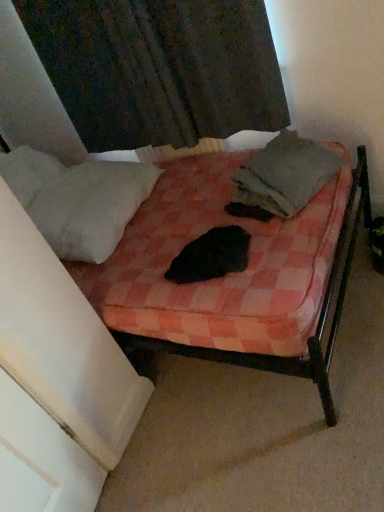
Question: Considering the relative positions of dark fabric curtain at upper center and pink checkered fabric bed at center in the image provided, is dark fabric curtain at upper center to the right of pink checkered fabric bed at center from the viewer's perspective?

Choices:
 (A) no
 (B) yes

Answer: (B)

Question: Does dark fabric curtain at upper center have a greater width compared to pink checkered fabric bed at center?

Choices:
 (A) no
 (B) yes

Answer: (A)

Question: Considering the relative sizes of dark fabric curtain at upper center and pink checkered fabric bed at center in the image provided, is dark fabric curtain at upper center bigger than pink checkered fabric bed at center?

Choices:
 (A) yes
 (B) no

Answer: (B)

Question: Can you confirm if dark fabric curtain at upper center is smaller than pink checkered fabric bed at center?

Choices:
 (A) no
 (B) yes

Answer: (B)

Question: Is dark fabric curtain at upper center completely or partially outside of pink checkered fabric bed at center?

Choices:
 (A) no
 (B) yes

Answer: (A)

Question: From the image's perspective, is gray cotton blanket at center positioned above or below dark fabric curtain at upper center?

Choices:
 (A) below
 (B) above

Answer: (A)

Question: Considering the positions of gray cotton blanket at center and dark fabric curtain at upper center in the image, is gray cotton blanket at center wider or thinner than dark fabric curtain at upper center?

Choices:
 (A) wide
 (B) thin

Answer: (A)

Question: Is gray cotton blanket at center situated inside dark fabric curtain at upper center or outside?

Choices:
 (A) inside
 (B) outside

Answer: (B)

Question: From a real-world perspective, is gray cotton blanket at center above or below dark fabric curtain at upper center?

Choices:
 (A) below
 (B) above

Answer: (A)

Question: Considering the positions of pink checkered fabric bed at center and gray cotton blanket at center in the image, is pink checkered fabric bed at center taller or shorter than gray cotton blanket at center?

Choices:
 (A) short
 (B) tall

Answer: (B)

Question: Considering the positions of pink checkered fabric bed at center and gray cotton blanket at center in the image, is pink checkered fabric bed at center wider or thinner than gray cotton blanket at center?

Choices:
 (A) thin
 (B) wide

Answer: (B)

Question: From the image's perspective, relative to gray cotton blanket at center, is pink checkered fabric bed at center above or below?

Choices:
 (A) above
 (B) below

Answer: (B)

Question: Is point (140, 338) positioned closer to the camera than point (284, 203)?

Choices:
 (A) farther
 (B) closer

Answer: (A)

Question: In the image, is pink checkered fabric bed at center on the left side or the right side of dark fabric curtain at upper center?

Choices:
 (A) right
 (B) left

Answer: (B)

Question: Is pink checkered fabric bed at center in front of or behind dark fabric curtain at upper center in the image?

Choices:
 (A) behind
 (B) front

Answer: (B)